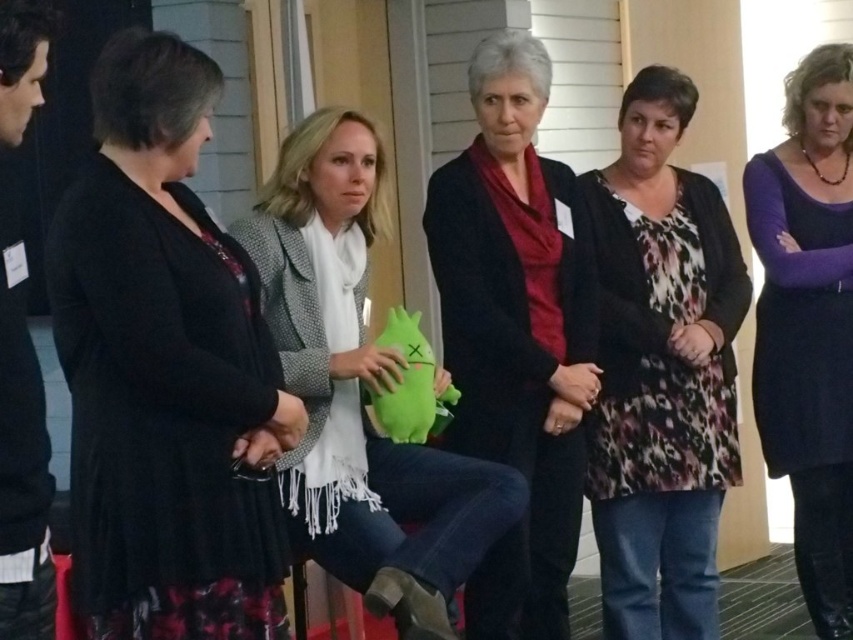
You are organizing a charity event and need to determine which clothing item takes up more space for storage. Based on the image, which item is larger between the black matte skirt at left and the purple matte dress at center?

The purple matte dress at center is larger than the black matte skirt at left, so it takes up more space for storage.

You are a photographer setting up for a group photo. You notice the black matte skirt at left and the purple matte dress at center. Which one is positioned nearer to the camera?

The black matte skirt at left is closer to the viewer than the purple matte dress at center, so the black matte skirt at left is nearer to the camera.